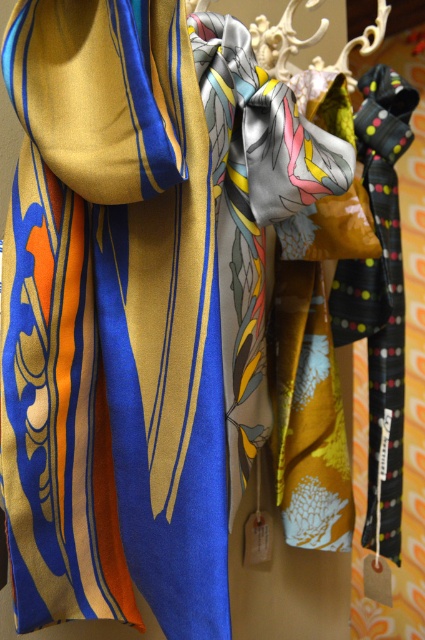
Who is taller, silky striped scarf at left or silky floral tie at center?

silky striped scarf at left is taller.

Which is in front, point (99, 179) or point (252, 356)?

Point (99, 179)

Who is more forward, (209, 561) or (227, 147)?

Point (209, 561) is more forward.

This screenshot has height=640, width=425. I want to click on silky striped scarf at left, so click(112, 323).